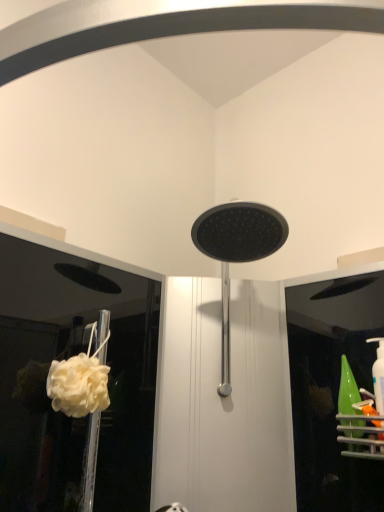
The image size is (384, 512). What do you see at coordinates (78, 385) in the screenshot? I see `white fluffy sponge at lower left` at bounding box center [78, 385].

You are a GUI agent. You are given a task and a screenshot of the screen. Output one action in this format:
    pyautogui.click(x=<x>, y=<y>)
    Task: Click on the white fluffy sponge at lower left
    The image size is (384, 512).
    Given the screenshot: What is the action you would take?
    pyautogui.click(x=78, y=385)

The height and width of the screenshot is (512, 384). Describe the element at coordinates (236, 252) in the screenshot. I see `matte black showerhead at center` at that location.

You are a GUI agent. You are given a task and a screenshot of the screen. Output one action in this format:
    pyautogui.click(x=<x>, y=<y>)
    Task: Click on the matte black showerhead at center
    
    Given the screenshot: What is the action you would take?
    pyautogui.click(x=236, y=252)

Find the location of a particular element. This screenshot has width=384, height=512. white fluffy sponge at lower left is located at coordinates (78, 385).

Between white fluffy sponge at lower left and matte black showerhead at center, which one appears on the left side from the viewer's perspective?

From the viewer's perspective, white fluffy sponge at lower left appears more on the left side.

Considering the positions of objects white fluffy sponge at lower left and matte black showerhead at center in the image provided, who is behind, white fluffy sponge at lower left or matte black showerhead at center?

white fluffy sponge at lower left is more distant.

Is point (75, 411) behind point (208, 222)?

No, it is in front of (208, 222).

From the image's perspective, is white fluffy sponge at lower left positioned above or below matte black showerhead at center?

Clearly, from the image's perspective, white fluffy sponge at lower left is below matte black showerhead at center.

Based on the photo, from a real-world perspective, which object stands above the other?

matte black showerhead at center, from a real-world perspective.

Does white fluffy sponge at lower left have a greater width compared to matte black showerhead at center?

No, white fluffy sponge at lower left is not wider than matte black showerhead at center.

Based on the photo, considering the sizes of objects white fluffy sponge at lower left and matte black showerhead at center in the image provided, who is shorter, white fluffy sponge at lower left or matte black showerhead at center?

white fluffy sponge at lower left.

Considering the sizes of white fluffy sponge at lower left and matte black showerhead at center in the image, is white fluffy sponge at lower left bigger or smaller than matte black showerhead at center?

Considering their sizes, white fluffy sponge at lower left takes up less space than matte black showerhead at center.

Could matte black showerhead at center be considered to be inside white fluffy sponge at lower left?

No, white fluffy sponge at lower left does not contain matte black showerhead at center.

From the picture: Is white fluffy sponge at lower left far from matte black showerhead at center?

No, there isn't a large distance between white fluffy sponge at lower left and matte black showerhead at center.

Is matte black showerhead at center at the back of white fluffy sponge at lower left?

white fluffy sponge at lower left does not have its back to matte black showerhead at center.

Can you tell me how much white fluffy sponge at lower left and matte black showerhead at center differ in facing direction?

The facing directions of white fluffy sponge at lower left and matte black showerhead at center are 46.9 degrees apart.

Measure the distance from white fluffy sponge at lower left to matte black showerhead at center.

white fluffy sponge at lower left is 13.82 inches away from matte black showerhead at center.

The height and width of the screenshot is (512, 384). Find the location of `shower in front of the white fluffy sponge at lower left`. shower in front of the white fluffy sponge at lower left is located at coordinates (236, 252).

Which object is positioned more to the right, matte black showerhead at center or white fluffy sponge at lower left?

Positioned to the right is matte black showerhead at center.

Which object is closer to the camera taking this photo, matte black showerhead at center or white fluffy sponge at lower left?

Positioned in front is matte black showerhead at center.

Considering the points (240, 233) and (83, 396), which point is in front, point (240, 233) or point (83, 396)?

The point (83, 396) is more forward.

From the image's perspective, between matte black showerhead at center and white fluffy sponge at lower left, which one is located above?

matte black showerhead at center.

From a real-world perspective, is matte black showerhead at center on white fluffy sponge at lower left?

Yes, from a real-world perspective, matte black showerhead at center is on top of white fluffy sponge at lower left.

Between matte black showerhead at center and white fluffy sponge at lower left, which one has larger width?

With larger width is matte black showerhead at center.

Between matte black showerhead at center and white fluffy sponge at lower left, which one has less height?

Standing shorter between the two is white fluffy sponge at lower left.

Is matte black showerhead at center smaller than white fluffy sponge at lower left?

No.

Which is correct: matte black showerhead at center is inside white fluffy sponge at lower left, or outside of it?

The correct answer is: outside.

Is matte black showerhead at center next to white fluffy sponge at lower left?

No, matte black showerhead at center is not beside white fluffy sponge at lower left.

Is matte black showerhead at center facing away from white fluffy sponge at lower left?

No, matte black showerhead at center is not facing away from white fluffy sponge at lower left.

How much distance is there between matte black showerhead at center and white fluffy sponge at lower left?

matte black showerhead at center and white fluffy sponge at lower left are 35.12 centimeters apart from each other.

Locate an element on the screen. The image size is (384, 512). flower lying behind the matte black showerhead at center is located at coordinates (78, 385).

The image size is (384, 512). Find the location of `shower located above the white fluffy sponge at lower left (from the image's perspective)`. shower located above the white fluffy sponge at lower left (from the image's perspective) is located at coordinates 236,252.

The image size is (384, 512). What are the coordinates of `flower below the matte black showerhead at center (from the image's perspective)` in the screenshot? It's located at (78, 385).